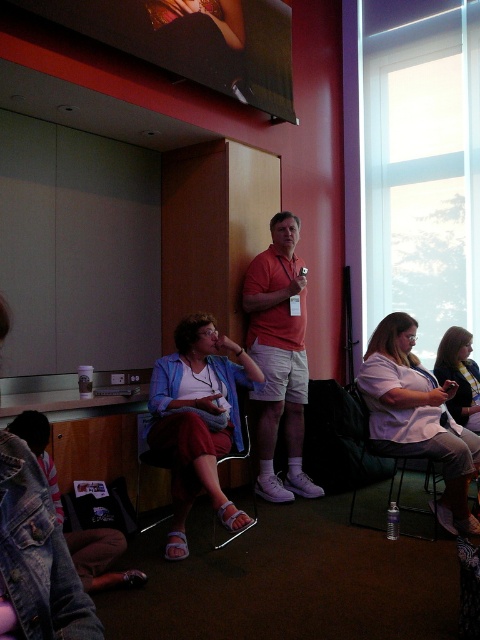
From the picture: Between matte blue shirt at center and matte orange shirt at center, which one appears on the left side from the viewer's perspective?

matte blue shirt at center

Identify the location of matte blue shirt at center. Image resolution: width=480 pixels, height=640 pixels. (197, 419).

Identify the location of matte blue shirt at center. (197, 419).

This screenshot has height=640, width=480. I want to click on matte blue shirt at center, so click(197, 419).

Between matte blue shirt at center and light purple shirt at center, which one has more height?

matte blue shirt at center

Who is more forward, (x=215, y=452) or (x=479, y=449)?

Point (x=215, y=452) is in front.

The width and height of the screenshot is (480, 640). I want to click on matte blue shirt at center, so click(x=197, y=419).

Can you confirm if matte orange shirt at center is bigger than matte pink shirt at center?

Correct, matte orange shirt at center is larger in size than matte pink shirt at center.

Between matte orange shirt at center and matte pink shirt at center, which one has less height?

With less height is matte pink shirt at center.

You are a GUI agent. You are given a task and a screenshot of the screen. Output one action in this format:
    pyautogui.click(x=<x>, y=<y>)
    Task: Click on the matte orange shirt at center
    The width and height of the screenshot is (480, 640).
    Given the screenshot: What is the action you would take?
    pyautogui.click(x=279, y=356)

The height and width of the screenshot is (640, 480). Find the location of `matte orange shirt at center`. matte orange shirt at center is located at coordinates (279, 356).